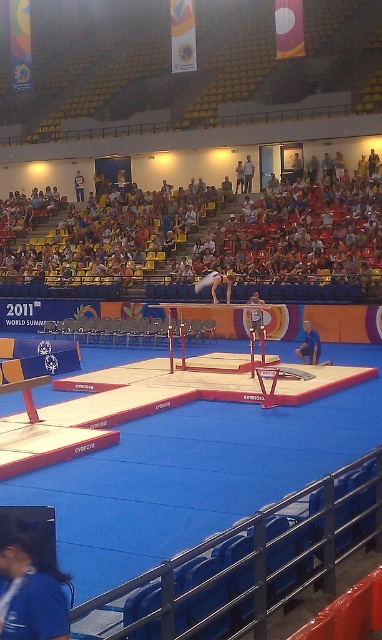
Is blue plastic barrier at lower right to the left of metallic red parallel bars at center from the viewer's perspective?

In fact, blue plastic barrier at lower right is to the right of metallic red parallel bars at center.

In the scene shown: Who is more distant from viewer, (360, 540) or (181, 330)?

The point (181, 330) is behind.

Based on the photo, who is more forward, (307, 518) or (182, 328)?

Point (307, 518) is in front.

This screenshot has height=640, width=382. In order to click on blue plastic barrier at lower right in this screenshot , I will do `click(254, 563)`.

Does blue fabric at lower left appear on the left side of white fluffy gymnast at center?

Yes, blue fabric at lower left is to the left of white fluffy gymnast at center.

Can you confirm if blue fabric at lower left is shorter than white fluffy gymnast at center?

Yes.

Find the location of a particular element. The width and height of the screenshot is (382, 640). blue fabric at lower left is located at coordinates (30, 582).

Which is in front, point (262, 337) or point (218, 273)?

Positioned in front is point (262, 337).

Based on the photo, does metallic red parallel bars at center have a lesser height compared to white fluffy gymnast at center?

In fact, metallic red parallel bars at center may be taller than white fluffy gymnast at center.

What do you see at coordinates (184, 346) in the screenshot?
I see `metallic red parallel bars at center` at bounding box center [184, 346].

Locate an element on the screen. This screenshot has width=382, height=640. metallic red parallel bars at center is located at coordinates [x=184, y=346].